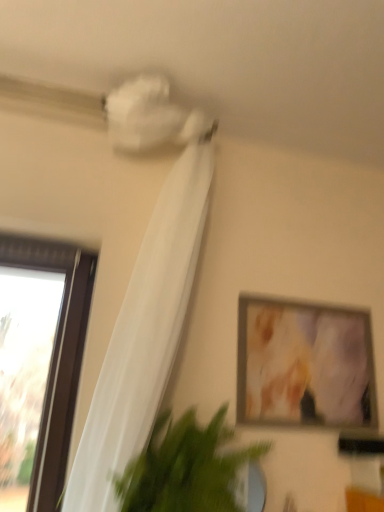
Question: From the image's perspective, relative to green leafy plant at lower left, is white sheer curtain at upper left above or below?

Choices:
 (A) above
 (B) below

Answer: (A)

Question: Is white sheer curtain at upper left wider or thinner than green leafy plant at lower left?

Choices:
 (A) thin
 (B) wide

Answer: (A)

Question: Which is nearer to the white sheer curtain at upper left?

Choices:
 (A) matte wooden picture frame at upper right
 (B) green leafy plant at lower left

Answer: (B)

Question: Which is farther from the green leafy plant at lower left?

Choices:
 (A) white sheer curtain at upper left
 (B) matte wooden picture frame at upper right

Answer: (B)